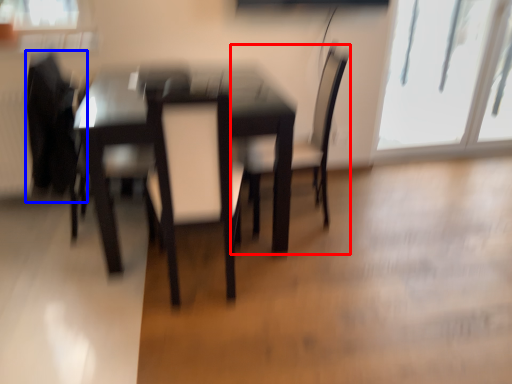
Question: Among these objects, which one is nearest to the camera, chair (highlighted by a red box) or swivel chair (highlighted by a blue box)?

Choices:
 (A) chair
 (B) swivel chair

Answer: (B)